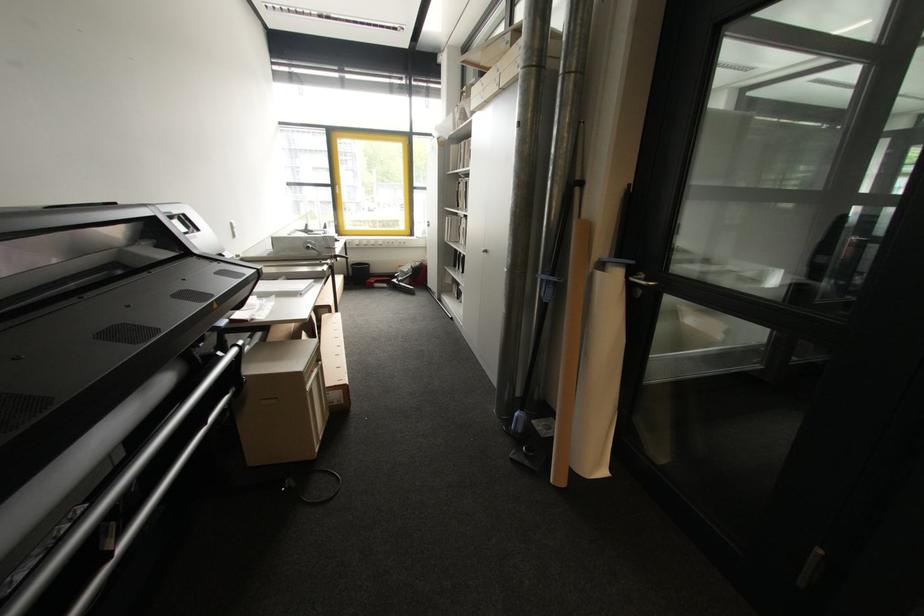
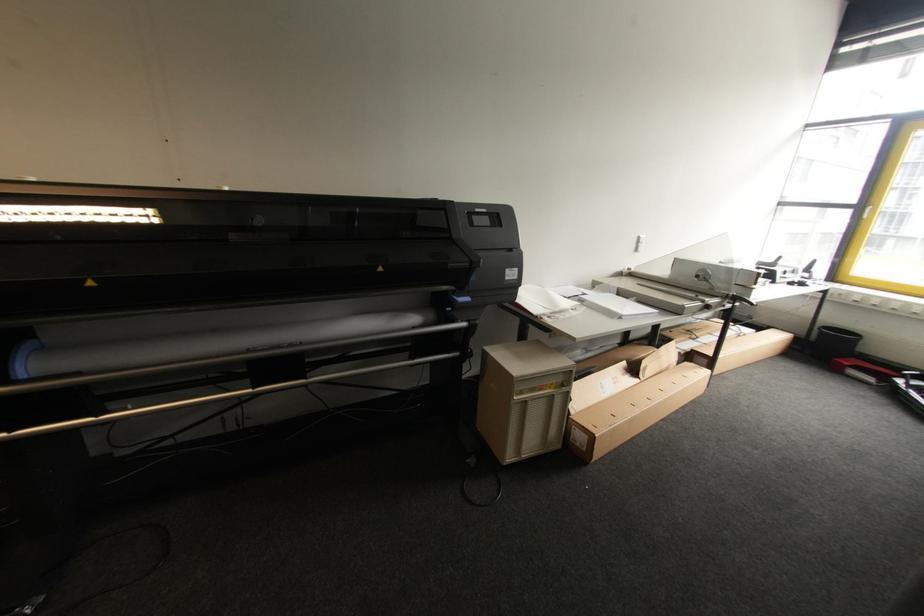
Question: Based on the continuous images, in which direction is the camera rotating? Reply with the corresponding letter.

Choices:
 (A) Left
 (B) Right
 (C) Up
 (D) Down

Answer: (A)